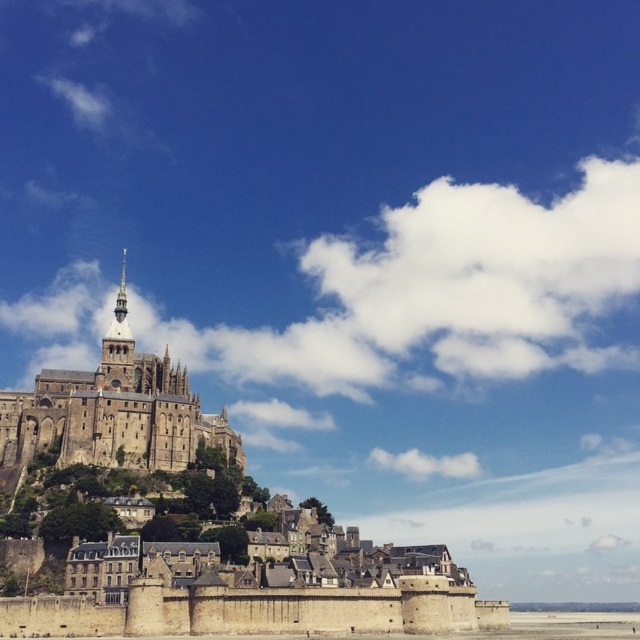
Question: Can you confirm if golden stone tower at upper left is positioned to the right of clear blue water at lower center?

Choices:
 (A) no
 (B) yes

Answer: (A)

Question: Does brown stone castle at center lie behind golden stone tower at upper left?

Choices:
 (A) no
 (B) yes

Answer: (A)

Question: Which point is farther to the camera?

Choices:
 (A) clear blue water at lower center
 (B) brown stone castle at center
 (C) golden stone tower at upper left

Answer: (A)

Question: Which of the following is the closest to the observer?

Choices:
 (A) (225, 428)
 (B) (524, 604)
 (C) (108, 384)

Answer: (C)

Question: Which point appears farthest from the camera in this image?

Choices:
 (A) (625, 604)
 (B) (157, 392)
 (C) (102, 362)

Answer: (A)

Question: Is brown stone castle at center positioned in front of clear blue water at lower center?

Choices:
 (A) yes
 (B) no

Answer: (A)